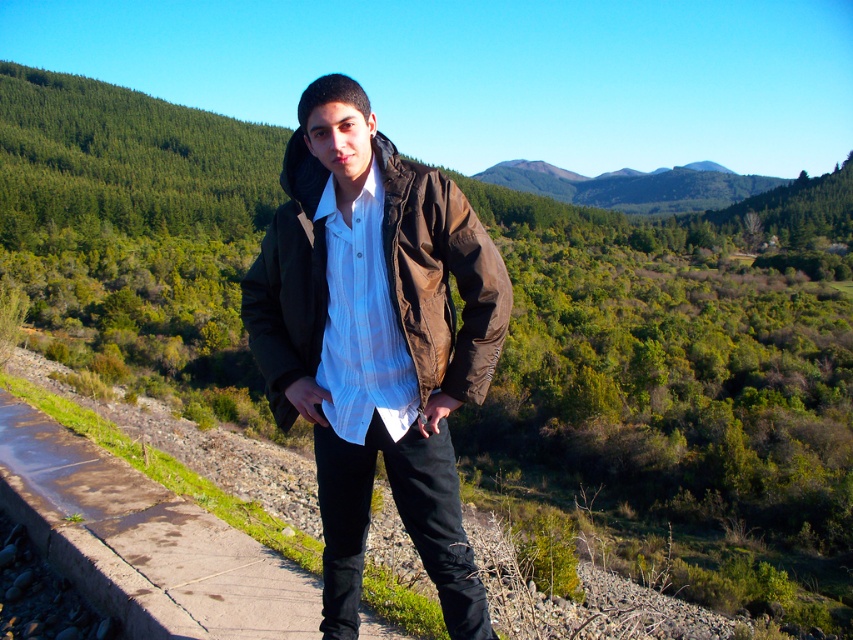
You are a delivery drone that needs to land on the concrete sidewalk at center. There is a person wearing a brown matte jacket at center nearby. What is the minimum distance you need to maintain between your landing spot and the person to ensure safety?

The concrete sidewalk at center and brown matte jacket at center are 3.96 feet apart from each other, so the drone should maintain a minimum distance of at least 3.96 feet from the person to ensure safety.

You are trying to take a photo of the concrete sidewalk at center but want to ensure the brown matte jacket at center is not blocking the view. Is the jacket in front of or behind the sidewalk?

The brown matte jacket at center is behind the concrete sidewalk at center, so it will not block the view of the sidewalk in your photo.

You are a photographer trying to capture the brown matte jacket at center and the concrete sidewalk at center in a single frame. Which object will appear larger in the photo?

The brown matte jacket at center will appear larger in the photo because it is larger than the concrete sidewalk at center, which is smaller according to the description.